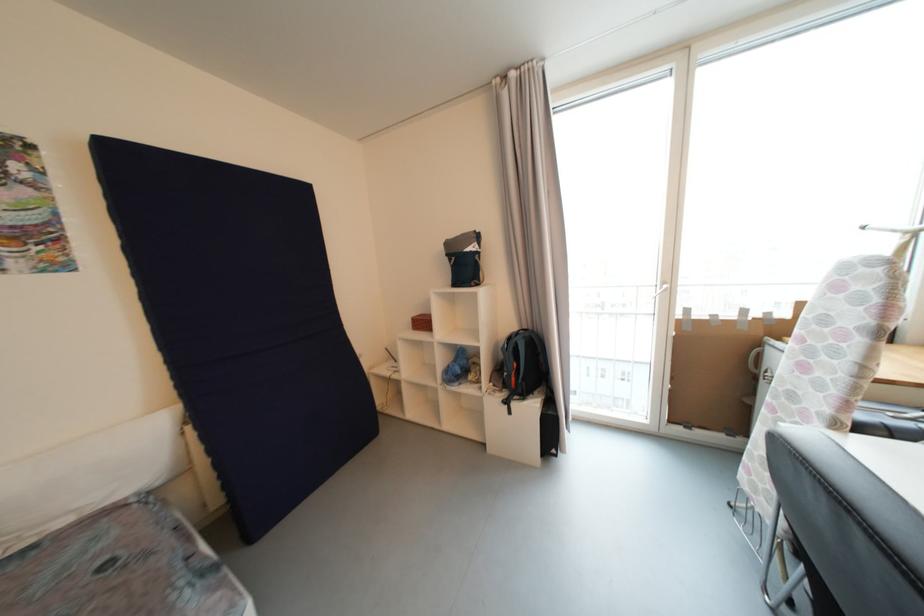
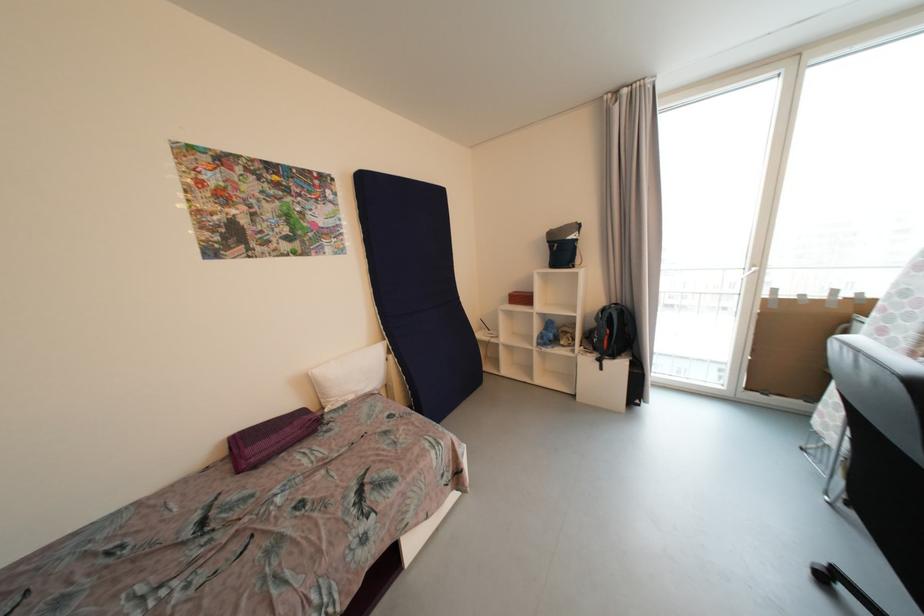
Find the pixel in the second image that matches the point at 515,341 in the first image.

(608, 312)